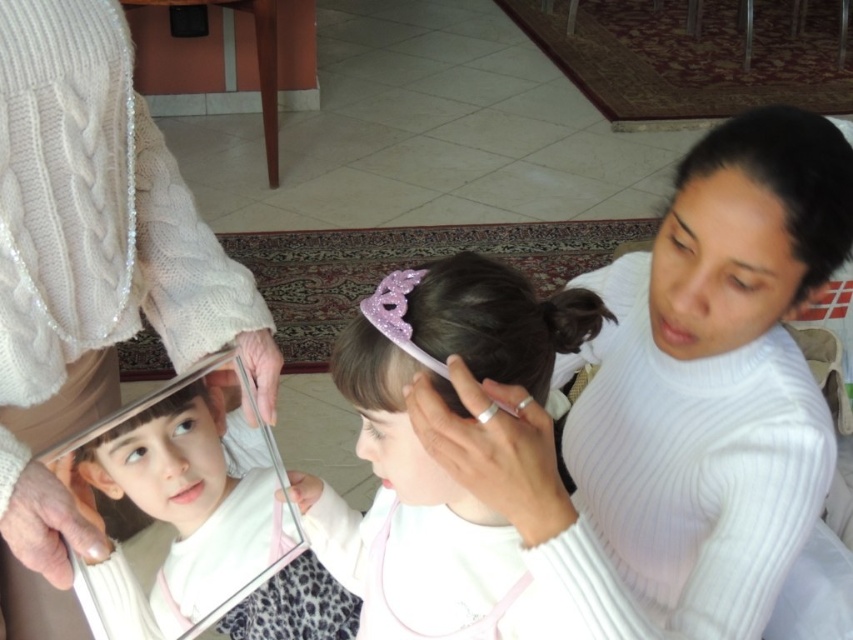
You are a photographer setting up a shoot in this room. You need to position a light source to the left of the silver metallic mirror at center. Will the light source be to the left or right of the white ribbed sweater at upper right?

The white ribbed sweater at upper right is to the right of the silver metallic mirror at center. Therefore, placing the light source to the left of the silver metallic mirror at center would position it to the left of the white ribbed sweater at upper right.

You are standing in the dining area and want to hand a gift to the person wearing the white ribbed sweater at upper right and the person wearing the purple glitter crown at center. Which person should you approach first based on their proximity to you?

You should approach the person wearing the white ribbed sweater at upper right first because it is closer to you than the purple glitter crown at center.